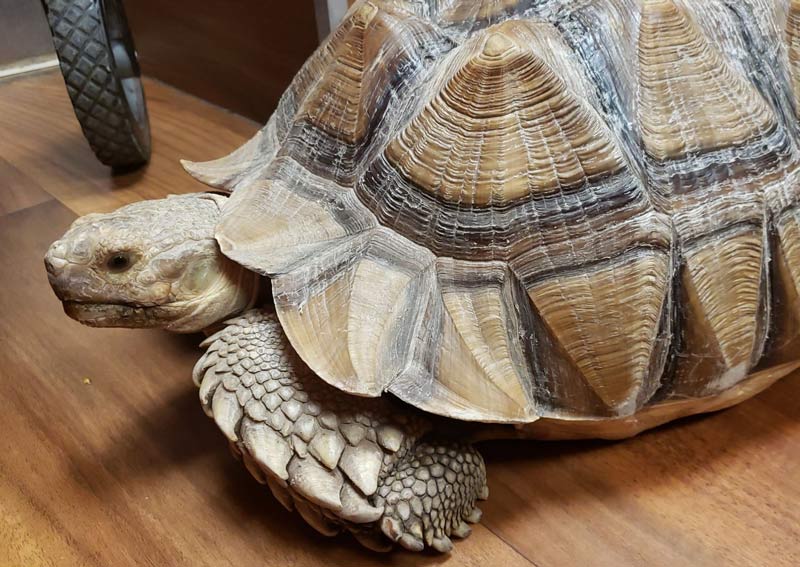
You are a GUI agent. You are given a task and a screenshot of the screen. Output one action in this format:
    pyautogui.click(x=<x>, y=<y>)
    Task: Click on the brown floor
    Image resolution: width=800 pixels, height=567 pixels.
    Given the screenshot: What is the action you would take?
    pyautogui.click(x=133, y=431)